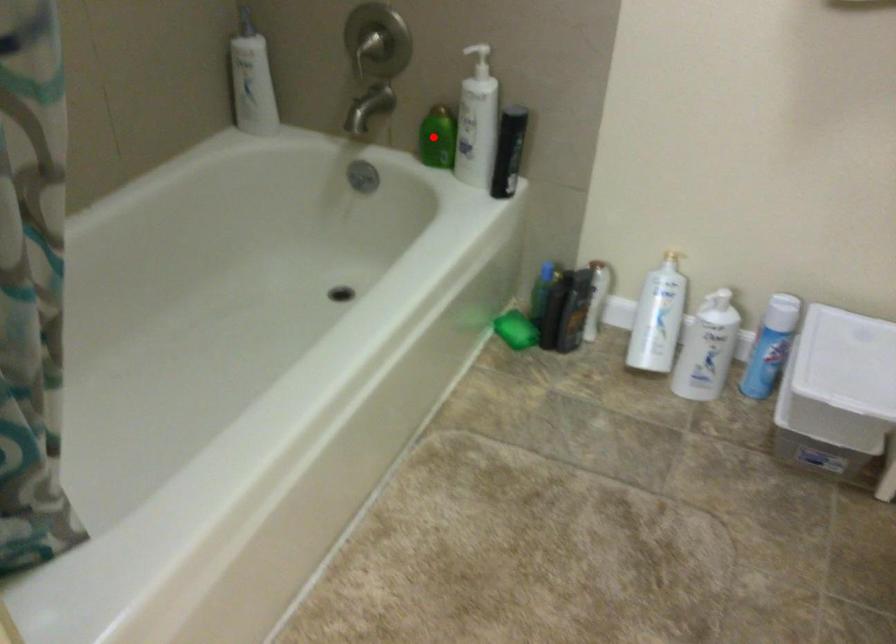
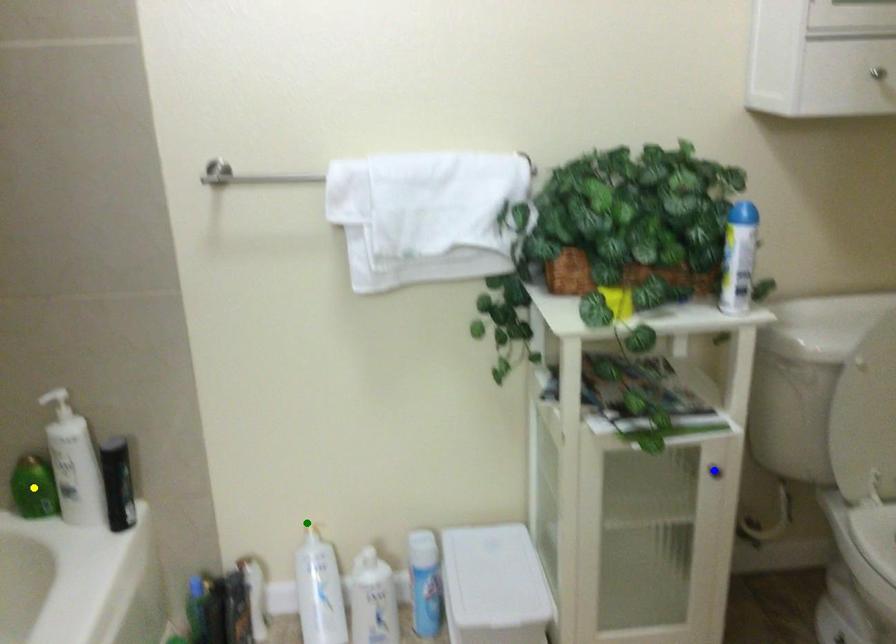
Question: I am providing you with two images of the same scene from different viewpoints. A red point is marked on the first image. You are given multiple points on the second image. Can you choose the point in image 2 that corresponds to the point in image 1?

Choices:
 (A) yellow point
 (B) blue point
 (C) green point

Answer: (A)